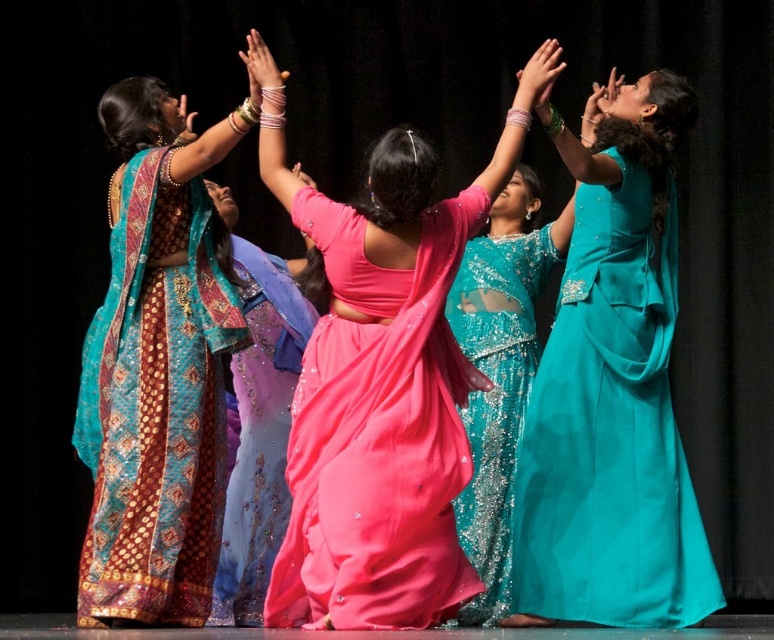
Question: Which point is closer to the camera?

Choices:
 (A) teal sequined saree at center
 (B) pink satin dress at center
 (C) pink satin saree at center

Answer: (C)

Question: Can you confirm if pink satin saree at center is wider than teal sequined saree at center?

Choices:
 (A) no
 (B) yes

Answer: (B)

Question: Which object is the closest to the teal satin dress at upper right?

Choices:
 (A) pink satin saree at center
 (B) teal sequined saree at center
 (C) matte teal saree at left

Answer: (B)

Question: Which point appears farthest from the camera in this image?

Choices:
 (A) (546, 340)
 (B) (461, 305)

Answer: (A)

Question: Can you confirm if teal satin dress at upper right is smaller than teal sequined saree at center?

Choices:
 (A) yes
 (B) no

Answer: (A)

Question: Considering the relative positions of pink satin saree at center and teal satin dress at upper right in the image provided, where is pink satin saree at center located with respect to teal satin dress at upper right?

Choices:
 (A) right
 (B) left

Answer: (B)